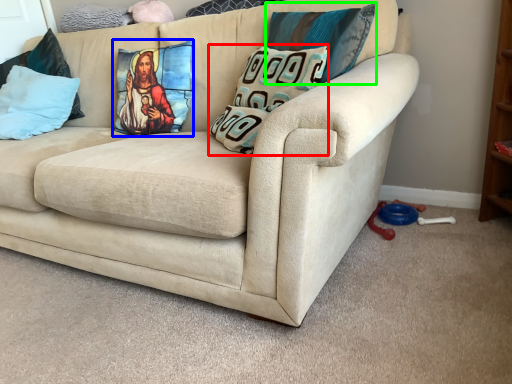
Question: Estimate the real-world distances between objects in this image. Which object is closer to pillow (highlighted by a red box), pillow (highlighted by a blue box) or pillow (highlighted by a green box)?

Choices:
 (A) pillow
 (B) pillow

Answer: (B)